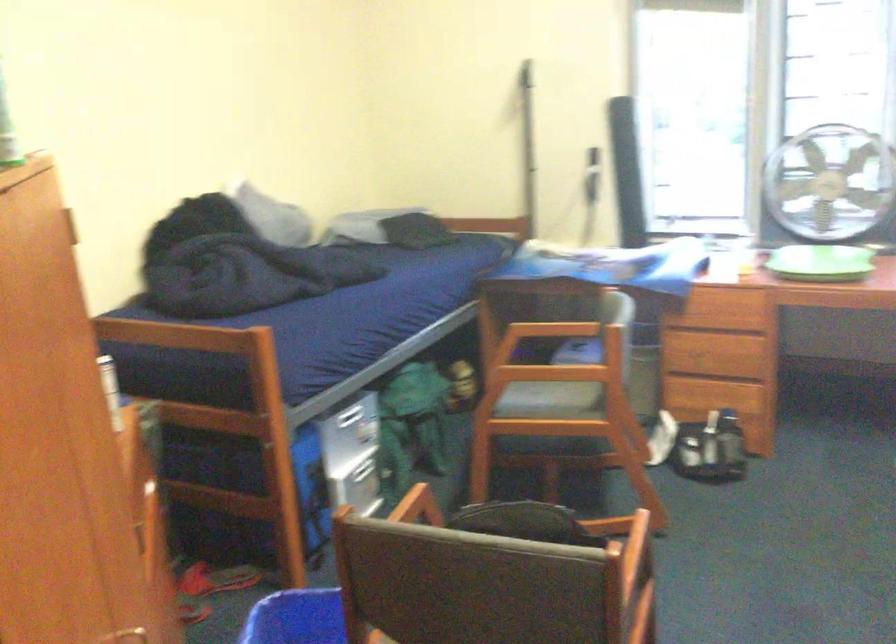
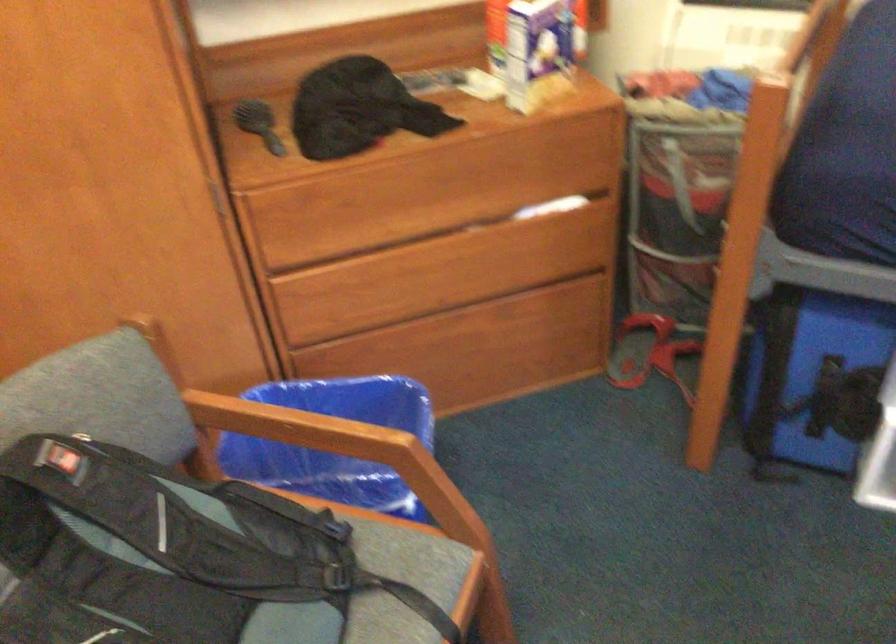
Locate, in the second image, the point that corresponds to [453,554] in the first image.

(162, 543)